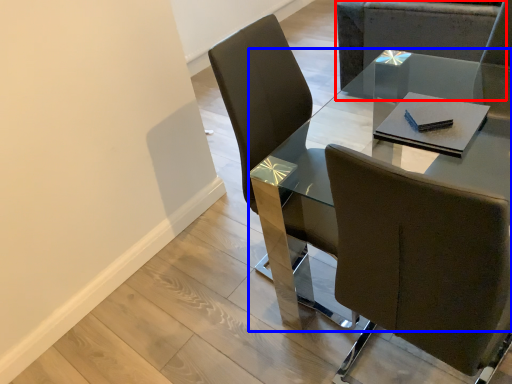
Question: Which object is further to the camera taking this photo, chair (highlighted by a red box) or table (highlighted by a blue box)?

Choices:
 (A) chair
 (B) table

Answer: (A)